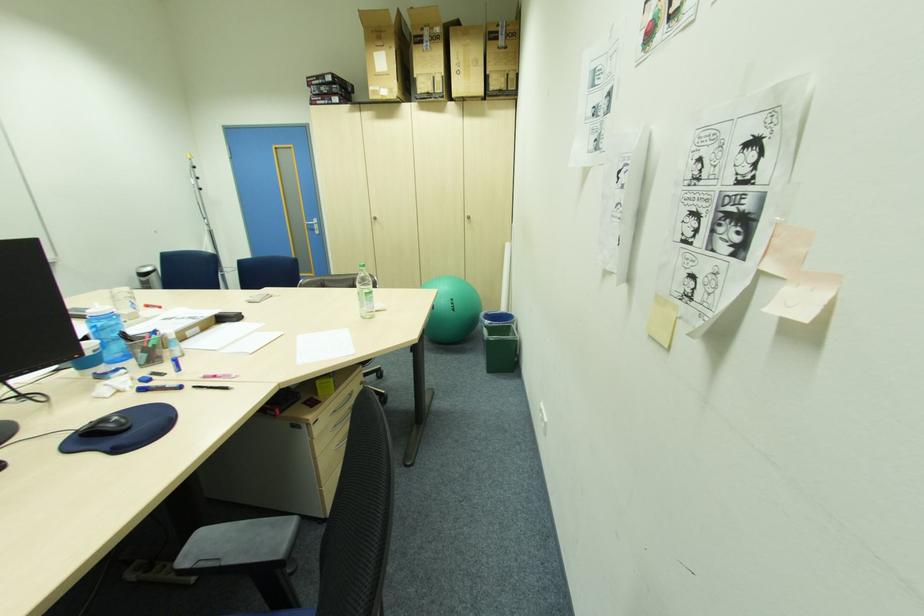
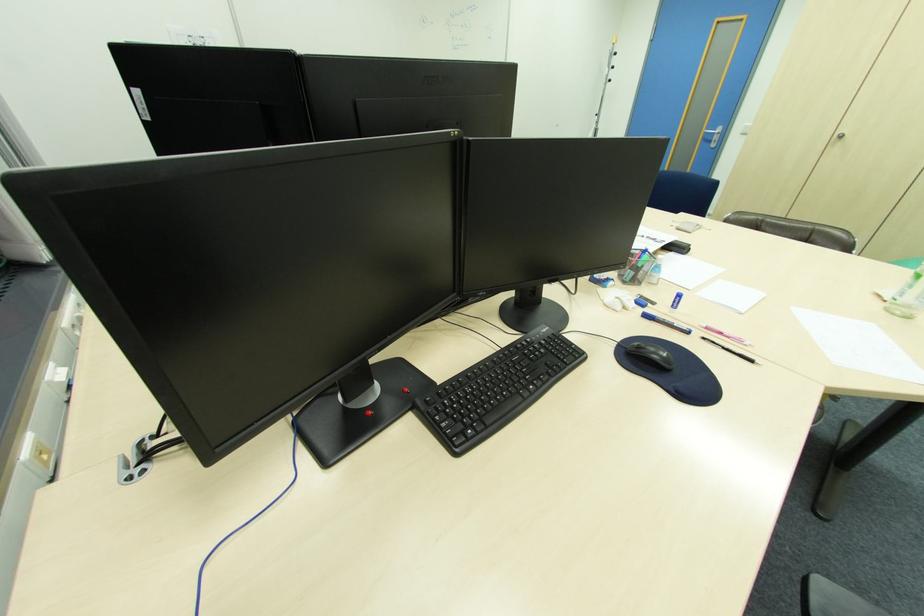
Find the pixel in the second image that matches point 149,357 in the first image.

(637, 274)